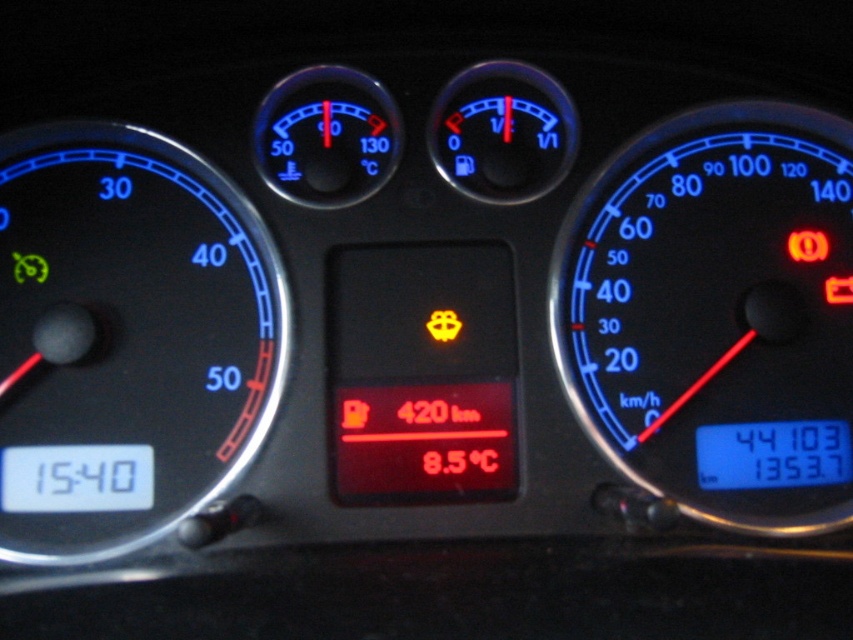
You are a mechanic working on a car dashboard. You need to install a new component between the blue plastic speedometer at right and the black plastic speedometer at left. The component requires 70 centimeters of space. Can the available space accommodate it?

The distance between the blue plastic speedometer at right and the black plastic speedometer at left is 73.05 centimeters, which is greater than the required 70 centimeters. Therefore, the space can accommodate the component.

You are a mechanic inspecting the car dashboard. You see the blue plastic speedometer at right and the black plastic speedometer at left. Which one is placed higher in the dashboard?

The blue plastic speedometer at right is positioned over the black plastic speedometer at left, so it is placed higher.

You are a driver checking your car dashboard. You see the blue plastic speedometer at right and the black plastic speedometer at left. Which one is located on the right side of the other?

The blue plastic speedometer at right is positioned on the right side of the black plastic speedometer at left.